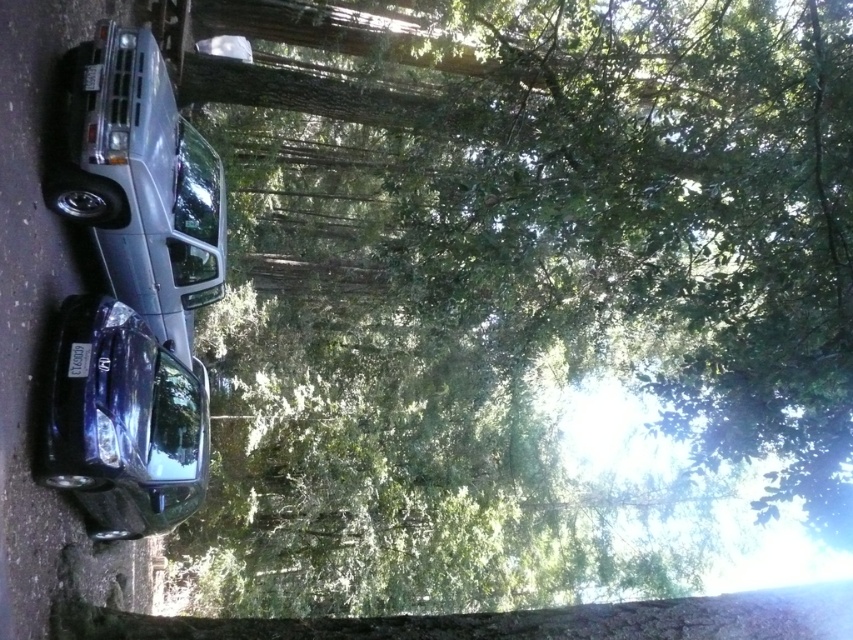
Question: Which point appears farthest from the camera in this image?

Choices:
 (A) (94, 381)
 (B) (106, 33)

Answer: (B)

Question: Among these points, which one is nearest to the camera?

Choices:
 (A) (74, 355)
 (B) (136, 237)

Answer: (A)

Question: Is the position of satin silver suv at left less distant than that of glossy metallic car at lower left?

Choices:
 (A) yes
 (B) no

Answer: (B)

Question: Which point appears farthest from the camera in this image?

Choices:
 (A) (186, 192)
 (B) (62, 388)

Answer: (A)

Question: Can you confirm if satin silver suv at left is bigger than glossy metallic car at lower left?

Choices:
 (A) no
 (B) yes

Answer: (B)

Question: Is satin silver suv at left below glossy metallic car at lower left?

Choices:
 (A) no
 (B) yes

Answer: (A)